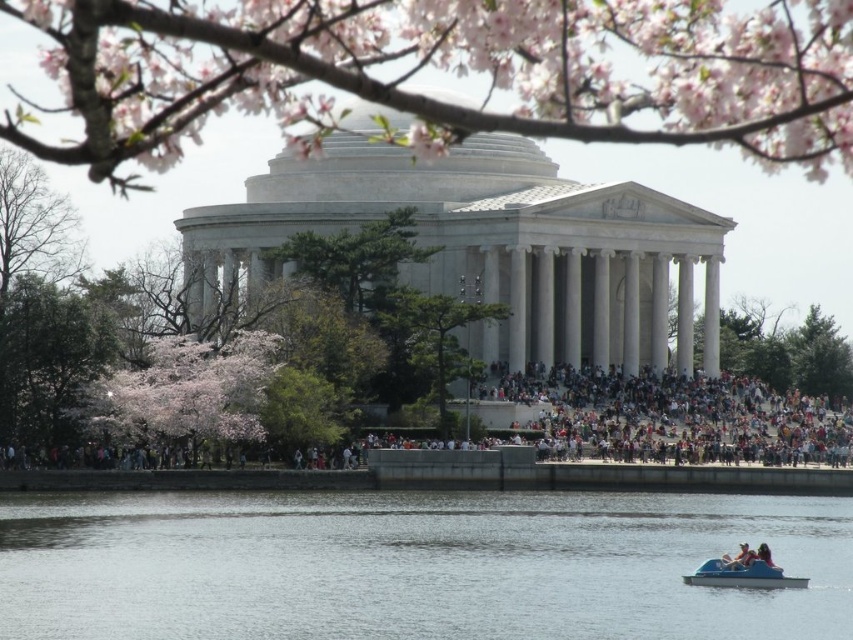
Question: Estimate the real-world distances between objects in this image. Which object is closer to the pink blossoms at center?

Choices:
 (A) green leafy tree at center
 (B) pink blossoms at lower left

Answer: (A)

Question: From the image, what is the correct spatial relationship of green leafy tree at center in relation to blue plastic boat at lower right?

Choices:
 (A) right
 (B) left

Answer: (B)

Question: Which object is the farthest from the green leafy tree at center?

Choices:
 (A) clear water at lower center
 (B) pink blossoms at lower left

Answer: (A)

Question: Which object is farther from the camera taking this photo?

Choices:
 (A) pink blossoms at lower left
 (B) green leafy tree at center
 (C) clear water at lower center
 (D) bare branches at left

Answer: (B)

Question: In this image, where is pink blossoms at center located relative to multicolored fabric crowd at center?

Choices:
 (A) below
 (B) above

Answer: (B)

Question: Is clear water at lower center above pink blossoms at center?

Choices:
 (A) no
 (B) yes

Answer: (A)